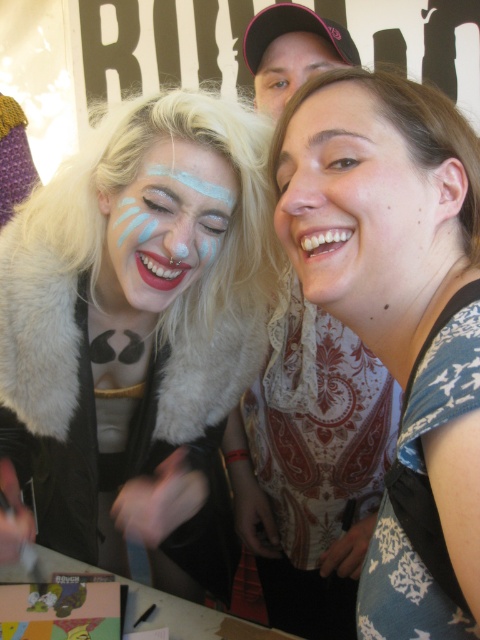
You are an artist observing the scene. You notice the matte white face paint at center and the matte black cap at upper center. Which object takes up more space in the image?

The matte white face paint at center is larger in size than the matte black cap at upper center, so it takes up more space in the image.

You are an artist trying to replicate the face paint design from the image. Based on the provided scene, which object is taller between the matte white face paint at center and the matte black cap at upper center?

The matte white face paint at center is taller than the matte black cap at upper center according to the description.